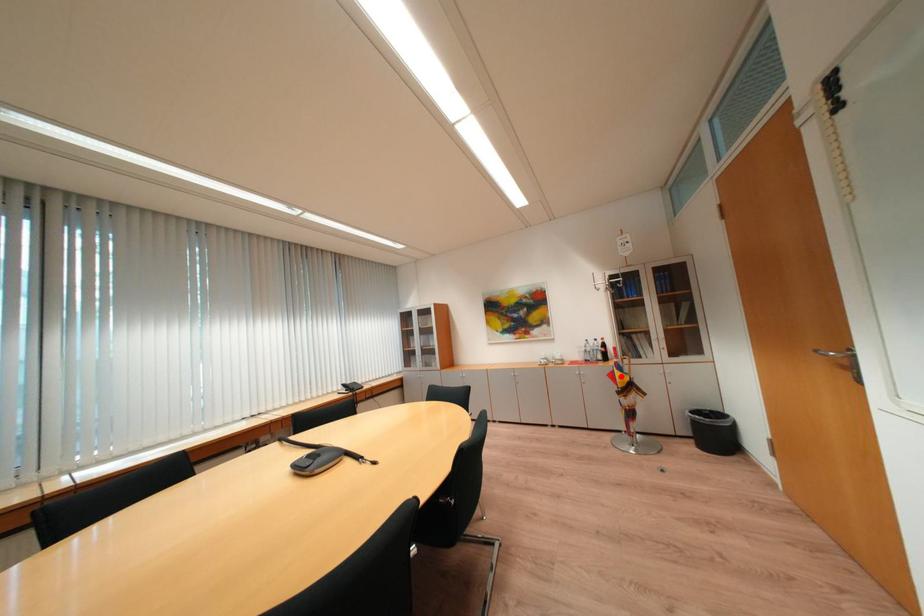
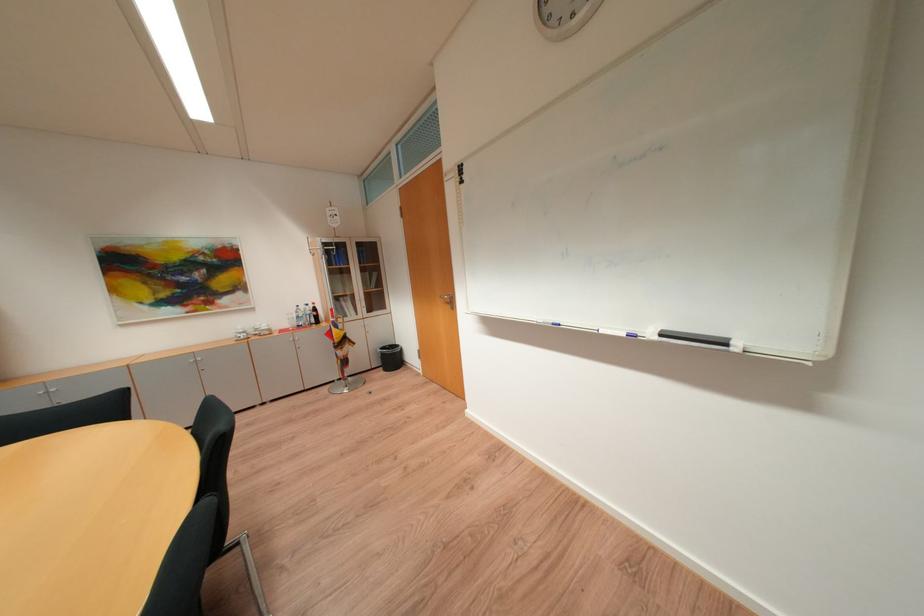
Where in the second image is the point corresponding to the highlighted location from the first image?

(338, 334)